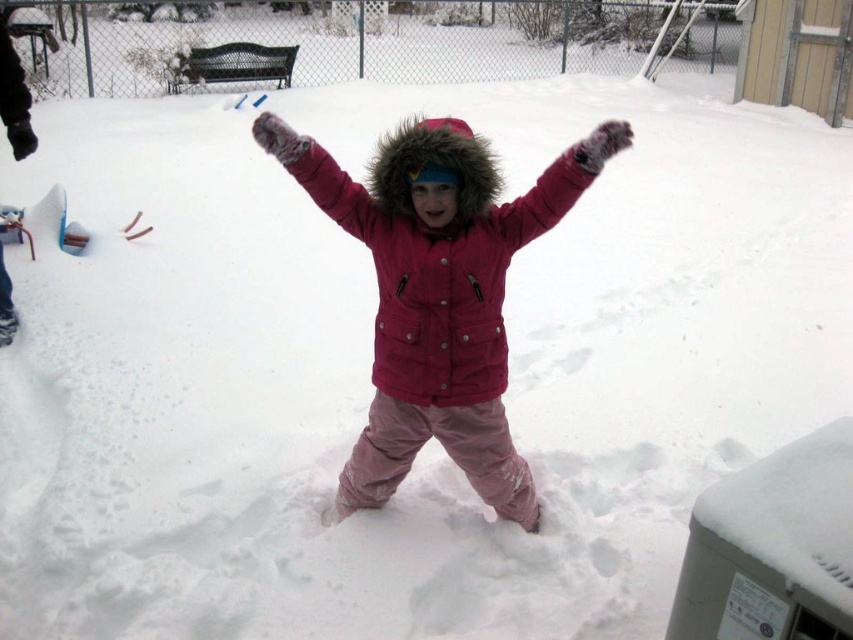
Consider the image. Who is shorter, fuzzy pink glove at center or fuzzy pink arm at center?

With less height is fuzzy pink glove at center.

What do you see at coordinates (560, 186) in the screenshot? The width and height of the screenshot is (853, 640). I see `fuzzy pink glove at center` at bounding box center [560, 186].

Identify the location of fuzzy pink glove at center. The width and height of the screenshot is (853, 640). (560, 186).

Who is shorter, matte pink snowsuit at center or fuzzy pink glove at center?

fuzzy pink glove at center is shorter.

Is point (471, 256) behind point (567, 195)?

No, it is not.

Where is `matte pink snowsuit at center`? This screenshot has height=640, width=853. matte pink snowsuit at center is located at coordinates (438, 294).

Between matte pink snowsuit at center and fuzzy pink arm at center, which one has more height?

matte pink snowsuit at center is taller.

Which of these two, matte pink snowsuit at center or fuzzy pink arm at center, stands shorter?

Standing shorter between the two is fuzzy pink arm at center.

This screenshot has height=640, width=853. In order to click on matte pink snowsuit at center in this screenshot , I will do `click(438, 294)`.